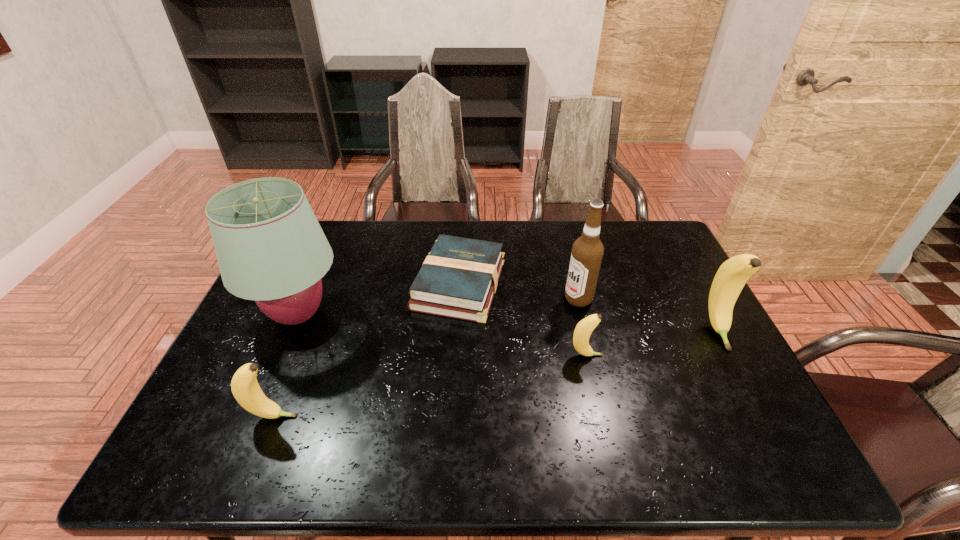
Where is `vacant region located 0.390m from the stem of the nearest banana`? The width and height of the screenshot is (960, 540). vacant region located 0.390m from the stem of the nearest banana is located at coordinates (466, 416).

Identify the location of blank area located 0.270m from the stem of the second banana from right to left. pyautogui.click(x=706, y=355).

The width and height of the screenshot is (960, 540). I want to click on free region located 0.070m from the stem of the rightmost banana, so click(740, 373).

I want to click on vacant space located on the label of the alcohol, so click(470, 299).

Identify the location of free space located on the label of the alcohol. Image resolution: width=960 pixels, height=540 pixels. (514, 299).

The width and height of the screenshot is (960, 540). I want to click on vacant space located on the label of the alcohol, so click(x=473, y=299).

This screenshot has width=960, height=540. What are the coordinates of `free space located 0.130m on the back of the lampshade` in the screenshot? It's located at (323, 257).

You are a GUI agent. You are given a task and a screenshot of the screen. Output one action in this format:
    pyautogui.click(x=<x>, y=<y>)
    Task: Click on the free space located 0.370m on the right of the third object from left to right
    
    Given the screenshot: What is the action you would take?
    pyautogui.click(x=626, y=284)

This screenshot has width=960, height=540. In order to click on object present at the far edge in this screenshot , I will do point(458,279).

Find the location of `object at the near edge`. object at the near edge is located at coordinates (244, 385).